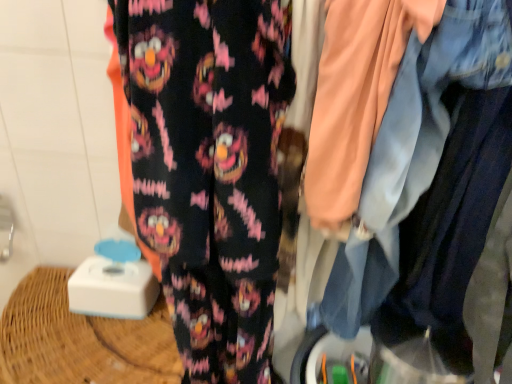
Question: Choose the correct answer: Is fluffy black pants at center inside faded denim jacket at upper right or outside it?

Choices:
 (A) inside
 (B) outside

Answer: (B)

Question: Is point (167, 233) positioned closer to the camera than point (402, 198)?

Choices:
 (A) closer
 (B) farther

Answer: (B)

Question: In terms of height, does fluffy black pants at center look taller or shorter compared to faded denim jacket at upper right?

Choices:
 (A) short
 (B) tall

Answer: (B)

Question: In terms of height, does faded denim jacket at upper right look taller or shorter compared to fluffy black pants at center?

Choices:
 (A) short
 (B) tall

Answer: (A)

Question: From the image's perspective, is faded denim jacket at upper right above or below fluffy black pants at center?

Choices:
 (A) below
 (B) above

Answer: (B)

Question: In terms of size, does faded denim jacket at upper right appear bigger or smaller than fluffy black pants at center?

Choices:
 (A) big
 (B) small

Answer: (A)

Question: Which is correct: faded denim jacket at upper right is inside fluffy black pants at center, or outside of it?

Choices:
 (A) outside
 (B) inside

Answer: (A)